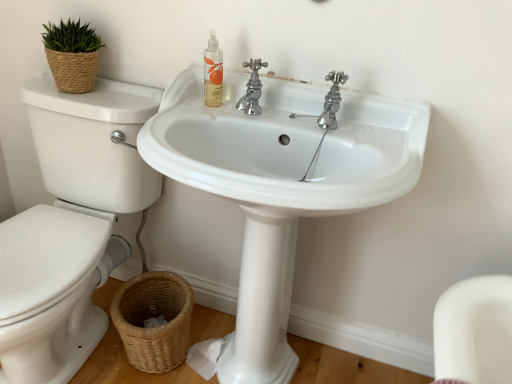
Question: Does woven brown basket at lower left come in front of chrome metallic faucet at upper center?

Choices:
 (A) yes
 (B) no

Answer: (B)

Question: From a real-world perspective, is woven brown basket at lower left below chrome metallic faucet at upper center?

Choices:
 (A) yes
 (B) no

Answer: (A)

Question: Is woven brown basket at lower left at the left side of chrome metallic faucet at upper center?

Choices:
 (A) yes
 (B) no

Answer: (A)

Question: Is woven brown basket at lower left smaller than chrome metallic faucet at upper center?

Choices:
 (A) yes
 (B) no

Answer: (B)

Question: Does woven brown basket at lower left have a lesser height compared to chrome metallic faucet at upper center?

Choices:
 (A) no
 (B) yes

Answer: (A)

Question: Does point (123, 253) appear closer or farther from the camera than point (218, 104)?

Choices:
 (A) closer
 (B) farther

Answer: (B)

Question: From a real-world perspective, is white glossy toilet at left positioned above or below translucent plastic bottle at upper center?

Choices:
 (A) above
 (B) below

Answer: (B)

Question: From the image's perspective, is white glossy toilet at left above or below translucent plastic bottle at upper center?

Choices:
 (A) above
 (B) below

Answer: (B)

Question: Considering the positions of white glossy toilet at left and translucent plastic bottle at upper center in the image, is white glossy toilet at left wider or thinner than translucent plastic bottle at upper center?

Choices:
 (A) thin
 (B) wide

Answer: (B)

Question: From a real-world perspective, is white glossy toilet at left positioned above or below chrome metallic faucet at upper center?

Choices:
 (A) above
 (B) below

Answer: (B)

Question: Considering the positions of white glossy toilet at left and chrome metallic faucet at upper center in the image, is white glossy toilet at left taller or shorter than chrome metallic faucet at upper center?

Choices:
 (A) short
 (B) tall

Answer: (B)

Question: From the image's perspective, relative to chrome metallic faucet at upper center, is white glossy toilet at left above or below?

Choices:
 (A) below
 (B) above

Answer: (A)

Question: Does point (47, 145) appear closer or farther from the camera than point (332, 127)?

Choices:
 (A) closer
 (B) farther

Answer: (B)

Question: From the image's perspective, is translucent plastic bottle at upper center positioned above or below white glossy sink at center?

Choices:
 (A) below
 (B) above

Answer: (B)

Question: From their relative heights in the image, would you say translucent plastic bottle at upper center is taller or shorter than white glossy sink at center?

Choices:
 (A) short
 (B) tall

Answer: (A)